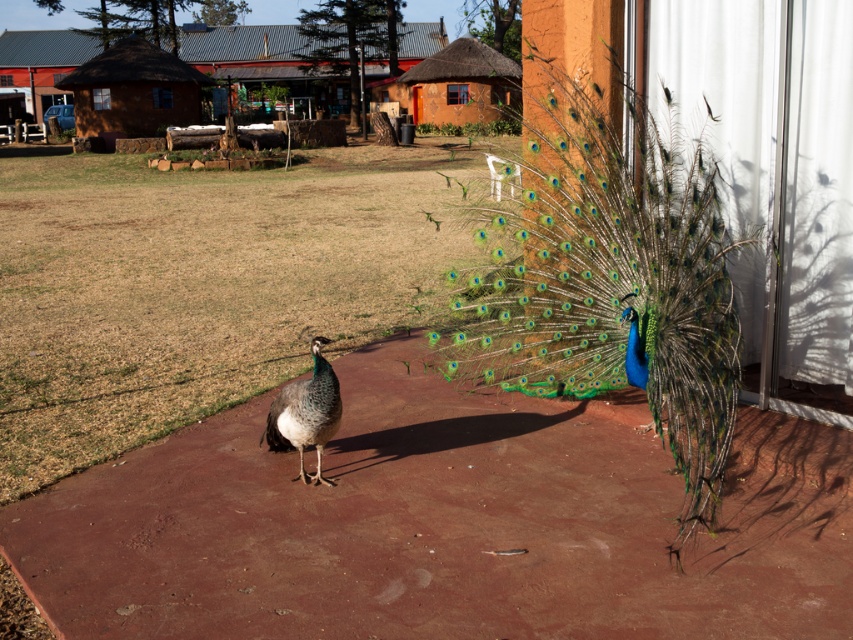
Between point (170, 106) and point (288, 442), which one is positioned in front?

Positioned in front is point (288, 442).

Is brown thatched hut at upper left behind shiny metallic tail at center?

Yes, it is behind shiny metallic tail at center.

Does point (151, 67) come behind point (276, 435)?

Yes, point (151, 67) is behind point (276, 435).

This screenshot has width=853, height=640. I want to click on brown thatched hut at upper left, so click(132, 90).

From the picture: Does brown thatched hut at upper left have a lesser height compared to terracotta thatched hut at center?

In fact, brown thatched hut at upper left may be taller than terracotta thatched hut at center.

The height and width of the screenshot is (640, 853). Find the location of `brown thatched hut at upper left`. brown thatched hut at upper left is located at coordinates click(x=132, y=90).

Is shiny blue peacock at center above brown thatched hut at upper left?

Actually, shiny blue peacock at center is below brown thatched hut at upper left.

This screenshot has height=640, width=853. In order to click on shiny blue peacock at center in this screenshot , I will do `click(614, 282)`.

At what (x,y) coordinates should I click in order to perform the action: click on shiny blue peacock at center. Please return your answer as a coordinate pair (x, y). The width and height of the screenshot is (853, 640). Looking at the image, I should click on (614, 282).